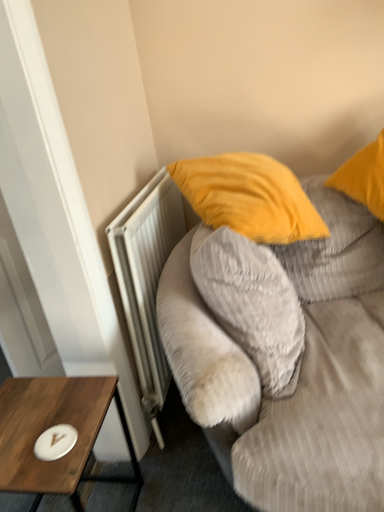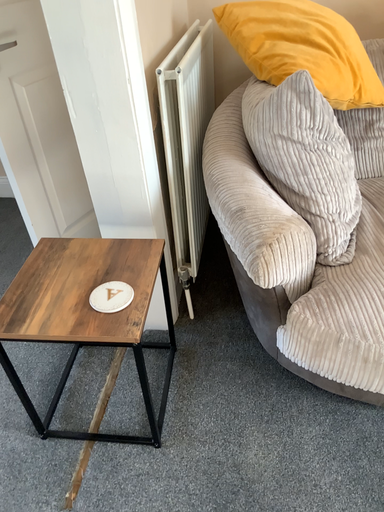
Question: Which way did the camera rotate in the video?

Choices:
 (A) rotated downward
 (B) rotated upward

Answer: (A)